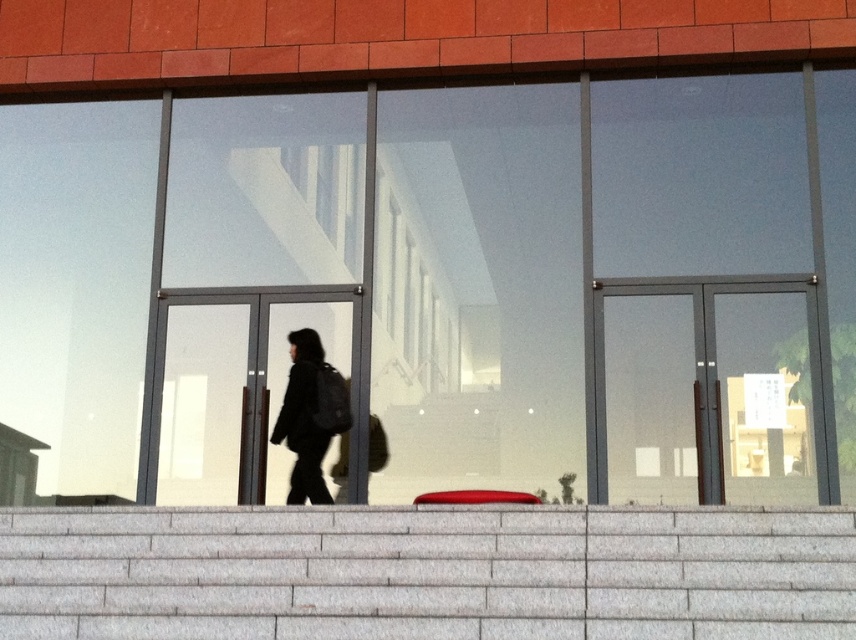
You are standing in front of the building and want to take a photo of the transparent glass window at center without including the gray stone stairs at lower center in the frame. Is it possible to do so given their sizes?

The transparent glass window at center is much taller than the gray stone stairs at lower center, so if you position yourself lower and zoom in on the window, you can exclude the stairs from the frame.

You are standing in front of the building and notice both the transparent glass window at center and the black matte backpack at center. Which object appears larger in size?

The black matte backpack at center appears larger than the transparent glass window at center because the transparent glass window at center is smaller than the black matte backpack at center.

You are standing in front of the building and want to enter through the entrance. Which object, the transparent glass window at center or the gray stone stairs at lower center, is closer to you?

The gray stone stairs at lower center is behind the transparent glass window at center, so the transparent glass window at center is closer to you.